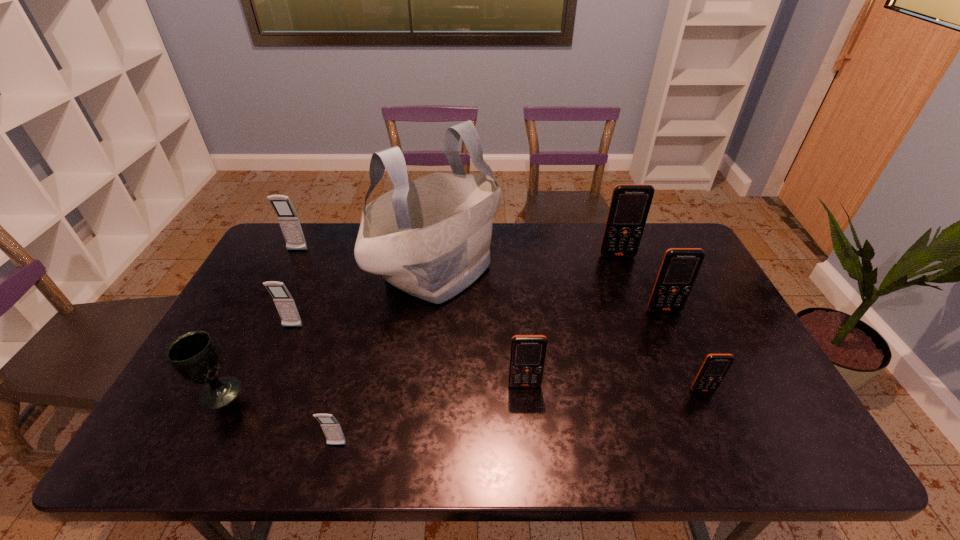
Select which object appears as the second closest to the smallest orange cellular telephone. Please provide its 2D coordinates. Your answer should be formatted as a tuple, i.e. [(x, y)], where the tuple contains the x and y coordinates of a point satisfying the conditions above.

[(527, 357)]

Locate which object ranks second in proximity to the fourth cellular telephone from left to right. Please provide its 2D coordinates. Your answer should be formatted as a tuple, i.e. [(x, y)], where the tuple contains the x and y coordinates of a point satisfying the conditions above.

[(715, 366)]

Find the location of a particular element. Image resolution: width=960 pixels, height=540 pixels. cellular telephone that is the fifth closest one to the chalice is located at coordinates (630, 203).

In order to click on the sixth closest cellular telephone to the biggest orange cellular telephone in this screenshot , I will do `click(287, 217)`.

Identify the location of orange cellular telephone object that ranks as the second closest to the second smallest orange cellular telephone. (680, 266).

Identify which orange cellular telephone is located as the third nearest to the second smallest gray cellular telephone. Please provide its 2D coordinates. Your answer should be formatted as a tuple, i.e. [(x, y)], where the tuple contains the x and y coordinates of a point satisfying the conditions above.

[(680, 266)]

Point out which gray cellular telephone is positioned as the second nearest to the smallest gray cellular telephone. Please provide its 2D coordinates. Your answer should be formatted as a tuple, i.e. [(x, y)], where the tuple contains the x and y coordinates of a point satisfying the conditions above.

[(287, 217)]

Identify which gray cellular telephone is the third closest to the tallest object. Please provide its 2D coordinates. Your answer should be formatted as a tuple, i.e. [(x, y)], where the tuple contains the x and y coordinates of a point satisfying the conditions above.

[(331, 427)]